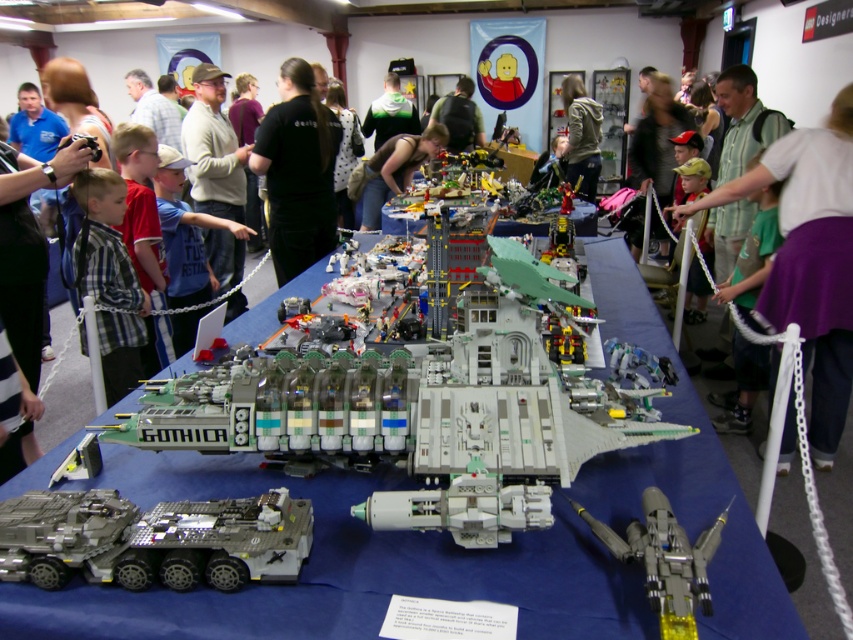
Question: Can you confirm if black backpack at center is positioned to the left of green jersey at center?

Choices:
 (A) no
 (B) yes

Answer: (A)

Question: Considering the relative positions of shiny silver jet at center and metallic silver spaceship at center in the image provided, where is shiny silver jet at center located with respect to metallic silver spaceship at center?

Choices:
 (A) above
 (B) below

Answer: (B)

Question: Which of the following is the closest to the observer?

Choices:
 (A) white plastic spaceship at center
 (B) blue plaid shirt at left
 (C) green jersey at center
 (D) black backpack at center

Answer: (A)

Question: Which of the following is the farthest from the observer?

Choices:
 (A) matte black shirt at center
 (B) matte gray spaceship at center

Answer: (A)

Question: Which object is closer to the camera taking this photo?

Choices:
 (A) white plastic spaceship at center
 (B) blue plaid shirt at left

Answer: (A)

Question: Is shiny metallic tank at center behind blue plaid shirt at left?

Choices:
 (A) yes
 (B) no

Answer: (B)